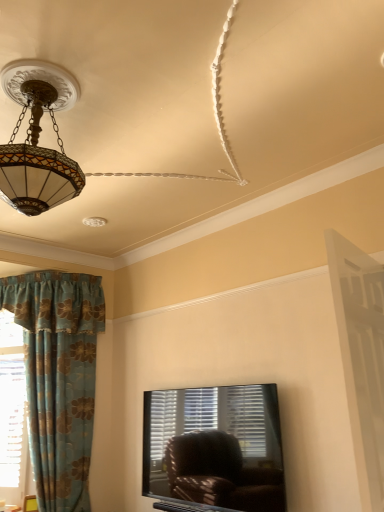
The height and width of the screenshot is (512, 384). What do you see at coordinates (38, 139) in the screenshot?
I see `tiffany glass pendant light at upper left` at bounding box center [38, 139].

What is the approximate height of tiffany glass pendant light at upper left?

tiffany glass pendant light at upper left is 23.66 inches tall.

At what (x,y) coordinates should I click in order to perform the action: click on blue floral fabric curtain at left. Please return your answer as a coordinate pair (x, y). This screenshot has height=512, width=384. Looking at the image, I should click on (59, 377).

Describe the element at coordinates (62, 140) in the screenshot. I see `matte glass chandelier at upper left` at that location.

Locate an element on the screen. tiffany glass pendant light at upper left is located at coordinates (38, 139).

Which is correct: tiffany glass pendant light at upper left is inside blue floral fabric curtain at left, or outside of it?

The correct answer is: outside.

How much distance is there between tiffany glass pendant light at upper left and blue floral fabric curtain at left?

A distance of 2.06 meters exists between tiffany glass pendant light at upper left and blue floral fabric curtain at left.

Considering the positions of objects tiffany glass pendant light at upper left and blue floral fabric curtain at left in the image provided, who is more to the left, tiffany glass pendant light at upper left or blue floral fabric curtain at left?

Positioned to the left is blue floral fabric curtain at left.

Is tiffany glass pendant light at upper left placed right next to blue floral fabric curtain at left?

There is a gap between tiffany glass pendant light at upper left and blue floral fabric curtain at left.

Could you tell me if tiffany glass pendant light at upper left is facing matte glass chandelier at upper left?

Yes, tiffany glass pendant light at upper left faces towards matte glass chandelier at upper left.

Consider the image. Which object is further away from the camera, tiffany glass pendant light at upper left or matte glass chandelier at upper left?

tiffany glass pendant light at upper left is behind.

From a real-world perspective, is tiffany glass pendant light at upper left physically located above or below matte glass chandelier at upper left?

From a real-world perspective, tiffany glass pendant light at upper left is physically below matte glass chandelier at upper left.

How distant is tiffany glass pendant light at upper left from matte glass chandelier at upper left?

0.39 inches.

In terms of size, does white wooden screen door at right appear bigger or smaller than blue floral fabric curtain at left?

white wooden screen door at right is smaller than blue floral fabric curtain at left.

The image size is (384, 512). Identify the location of screen door lying on the right of blue floral fabric curtain at left. (361, 357).

Is white wooden screen door at right taller than blue floral fabric curtain at left?

Incorrect, the height of white wooden screen door at right is not larger of that of blue floral fabric curtain at left.

Does white wooden screen door at right appear on the left side of blue floral fabric curtain at left?

Incorrect, white wooden screen door at right is not on the left side of blue floral fabric curtain at left.

From a real-world perspective, which object stands above the other?

tiffany glass pendant light at upper left, from a real-world perspective.

From the picture: Is tiffany glass pendant light at upper left shorter than white wooden screen door at right?

Correct, tiffany glass pendant light at upper left is not as tall as white wooden screen door at right.

Is tiffany glass pendant light at upper left outside of white wooden screen door at right?

tiffany glass pendant light at upper left is positioned outside white wooden screen door at right.

Which is nearer, (x=73, y=178) or (x=350, y=315)?

Point (x=73, y=178) is positioned farther from the camera compared to point (x=350, y=315).

Considering the sizes of objects matte glass chandelier at upper left and white wooden screen door at right in the image provided, who is taller, matte glass chandelier at upper left or white wooden screen door at right?

white wooden screen door at right is taller.

Is matte glass chandelier at upper left in contact with white wooden screen door at right?

No, matte glass chandelier at upper left is not touching white wooden screen door at right.

Is the position of matte glass chandelier at upper left more distant than that of white wooden screen door at right?

No.

Which is in front, point (21, 282) or point (7, 148)?

The point (7, 148) is in front.

Is blue floral fabric curtain at left turned away from tiffany glass pendant light at upper left?

blue floral fabric curtain at left is not turned away from tiffany glass pendant light at upper left.

Is blue floral fabric curtain at left not near tiffany glass pendant light at upper left?

Yes, blue floral fabric curtain at left and tiffany glass pendant light at upper left are quite far apart.

Does blue floral fabric curtain at left have a greater width compared to tiffany glass pendant light at upper left?

Incorrect, the width of blue floral fabric curtain at left does not surpass that of tiffany glass pendant light at upper left.

Find the location of a particular element. Image resolution: width=384 pixels, height=512 pixels. screen door on the right of tiffany glass pendant light at upper left is located at coordinates (361, 357).

Based on their sizes in the image, would you say white wooden screen door at right is bigger or smaller than tiffany glass pendant light at upper left?

In the image, white wooden screen door at right appears to be smaller than tiffany glass pendant light at upper left.

From the image's perspective, is white wooden screen door at right over tiffany glass pendant light at upper left?

No.

I want to click on curtain to the left of tiffany glass pendant light at upper left, so click(x=59, y=377).

Identify the location of lamp behind the matte glass chandelier at upper left. Image resolution: width=384 pixels, height=512 pixels. tap(38, 139).

From the image, which object appears to be farther from blue floral fabric curtain at left, matte glass chandelier at upper left or white wooden screen door at right?

Based on the image, white wooden screen door at right appears to be further to blue floral fabric curtain at left.

Which object lies nearer to the anchor point matte glass chandelier at upper left, blue floral fabric curtain at left or white wooden screen door at right?

white wooden screen door at right lies closer to matte glass chandelier at upper left than the other object.

Consider the image. Which object lies nearer to the anchor point white wooden screen door at right, tiffany glass pendant light at upper left or matte glass chandelier at upper left?

tiffany glass pendant light at upper left.

From the image, which object appears to be farther from tiffany glass pendant light at upper left, matte glass chandelier at upper left or blue floral fabric curtain at left?

Among the two, blue floral fabric curtain at left is located further to tiffany glass pendant light at upper left.

Based on their spatial positions, is blue floral fabric curtain at left or matte glass chandelier at upper left closer to white wooden screen door at right?

matte glass chandelier at upper left is closer to white wooden screen door at right.

Based on their spatial positions, is blue floral fabric curtain at left or tiffany glass pendant light at upper left closer to white wooden screen door at right?

Among the two, tiffany glass pendant light at upper left is located nearer to white wooden screen door at right.

Based on their spatial positions, is white wooden screen door at right or blue floral fabric curtain at left further from tiffany glass pendant light at upper left?

blue floral fabric curtain at left is further to tiffany glass pendant light at upper left.

Based on their spatial positions, is tiffany glass pendant light at upper left or white wooden screen door at right further from blue floral fabric curtain at left?

Based on the image, white wooden screen door at right appears to be further to blue floral fabric curtain at left.

Locate an element on the screen. The width and height of the screenshot is (384, 512). lamp located between matte glass chandelier at upper left and blue floral fabric curtain at left in the depth direction is located at coordinates (38, 139).

You are a GUI agent. You are given a task and a screenshot of the screen. Output one action in this format:
    pyautogui.click(x=<x>, y=<y>)
    Task: Click on the lamp situated between blue floral fabric curtain at left and white wooden screen door at right from left to right
    This screenshot has height=512, width=384.
    Given the screenshot: What is the action you would take?
    pyautogui.click(x=38, y=139)

The height and width of the screenshot is (512, 384). What are the coordinates of `fan between tiffany glass pendant light at upper left and white wooden screen door at right from left to right` in the screenshot? It's located at (62, 140).

This screenshot has width=384, height=512. I want to click on screen door located between matte glass chandelier at upper left and blue floral fabric curtain at left in the depth direction, so click(361, 357).